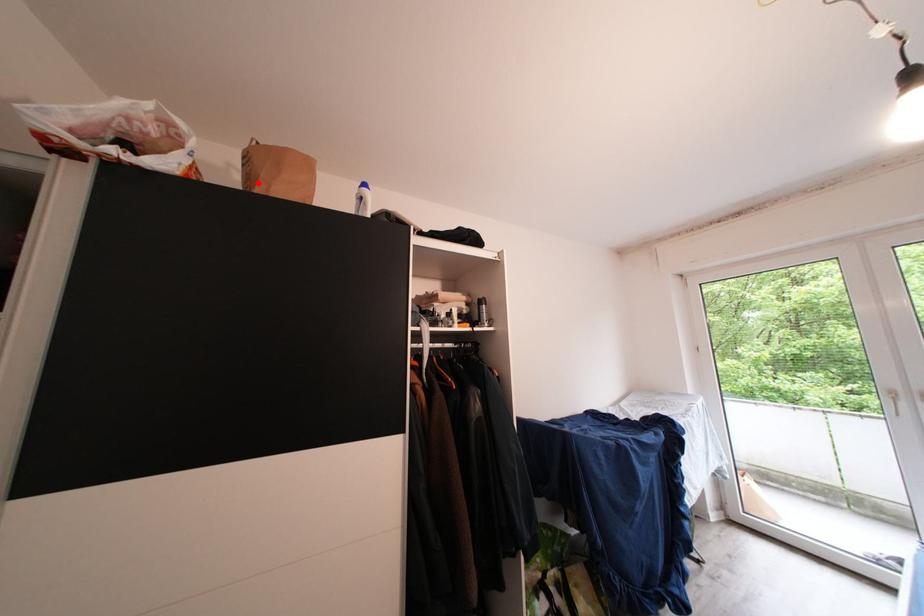
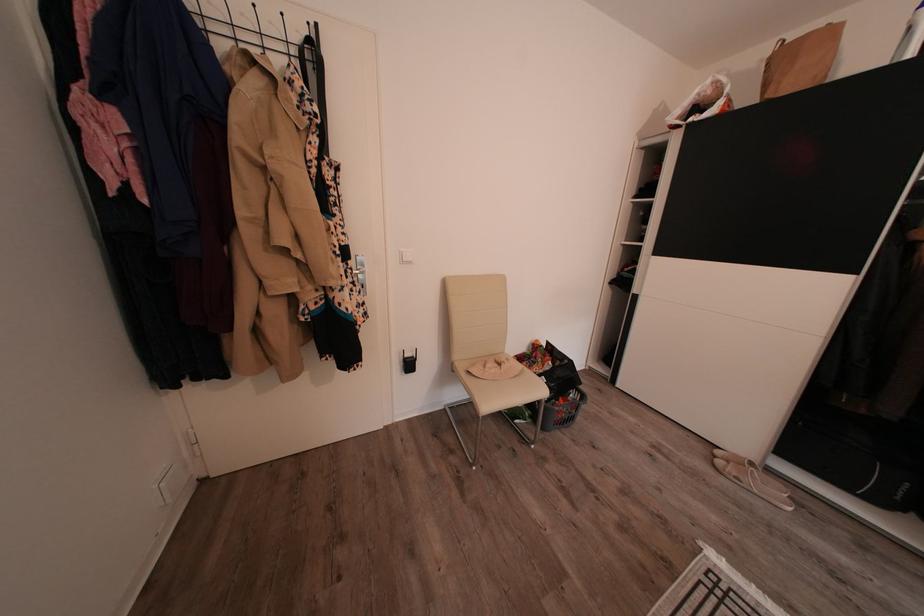
Where in the second image is the point corresponding to the highlighted location from the first image?

(773, 91)